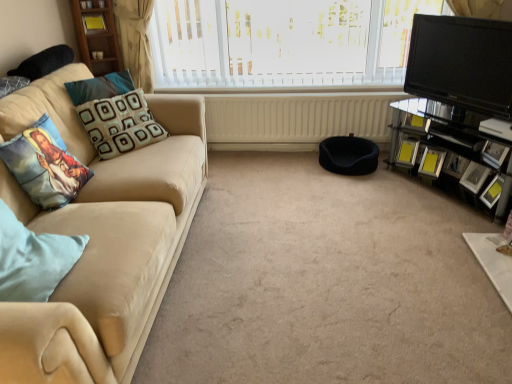
In order to face matte black picture frame at right, which is the 3th picture frame from back to front, should I rotate leftwards or rightwards?

You should rotate right by 27.294 degrees.

In order to face light blue fabric pillow at left, the third pillow from the back, should I rotate leftwards or rightwards?

You should look left and rotate roughly 29.952 degrees.

Measure the distance between yellow paper at right, the first picture frame from the back, and camera.

A distance of 3.16 meters exists between yellow paper at right, the first picture frame from the back, and camera.

What do you see at coordinates (407, 152) in the screenshot? Image resolution: width=512 pixels, height=384 pixels. I see `yellow paper at right, the 5th picture frame viewed from the front` at bounding box center [407, 152].

This screenshot has height=384, width=512. Describe the element at coordinates (494, 154) in the screenshot. I see `metallic silver picture frame at right, positioned as the first picture frame in front-to-back order` at that location.

Identify the location of carpet at center. The width and height of the screenshot is (512, 384). (326, 283).

At what (x,y) coordinates should I click in order to perform the action: click on matte black picture frame at right, which is counted as the 3th picture frame, starting from the front. Please return your answer as a coordinate pair (x, y). This screenshot has width=512, height=384. Looking at the image, I should click on (474, 177).

Is point (296, 56) farther from camera compared to point (441, 168)?

Yes, it is.

How different are the orientations of white textured blinds at upper center and metallic silver picture frame at right, which is the fourth picture frame in front-to-back order, in degrees?

The angular difference between white textured blinds at upper center and metallic silver picture frame at right, which is the fourth picture frame in front-to-back order, is 34.3 degrees.

From the image's perspective, which one is positioned lower, white textured blinds at upper center or metallic silver picture frame at right, the 2th picture frame viewed from the back?

metallic silver picture frame at right, the 2th picture frame viewed from the back.

Which of these two, white textured blinds at upper center or metallic silver picture frame at right, the 2th picture frame viewed from the back, is smaller?

Smaller between the two is metallic silver picture frame at right, the 2th picture frame viewed from the back.

In terms of size, does carpet at center appear bigger or smaller than white glossy table at lower right?

Considering their sizes, carpet at center takes up more space than white glossy table at lower right.

Which object is thinner, carpet at center or white glossy table at lower right?

With smaller width is white glossy table at lower right.

Locate an element on the screen. The image size is (512, 384). plain lying above the white glossy table at lower right (from the image's perspective) is located at coordinates (326, 283).

From a real-world perspective, which is physically above, carpet at center or white glossy table at lower right?

white glossy table at lower right.

How many degrees apart are the facing directions of matte black picture frame at right, which is counted as the 3th picture frame, starting from the front, and black glossy entertainment center at right?

They differ by 15.1 degrees in their facing directions.

Is point (477, 171) farther from viewer compared to point (510, 151)?

Yes, it is behind point (510, 151).

Considering the sizes of objects matte black picture frame at right, which is the 3th picture frame from back to front, and black glossy entertainment center at right in the image provided, who is wider, matte black picture frame at right, which is the 3th picture frame from back to front, or black glossy entertainment center at right?

black glossy entertainment center at right is wider.

In the scene shown: Is matte black picture frame at right, which is counted as the 3th picture frame, starting from the front, at the right side of black glossy entertainment center at right?

Correct, you'll find matte black picture frame at right, which is counted as the 3th picture frame, starting from the front, to the right of black glossy entertainment center at right.

Choose the correct answer: Is metallic silver picture frame at right, the 2th picture frame viewed from the back, inside black glossy entertainment center at right or outside it?

metallic silver picture frame at right, the 2th picture frame viewed from the back, fits inside black glossy entertainment center at right.

In the image, is metallic silver picture frame at right, the 2th picture frame viewed from the back, positioned in front of or behind black glossy entertainment center at right?

In the image, metallic silver picture frame at right, the 2th picture frame viewed from the back, appears behind black glossy entertainment center at right.

Looking at this image, is metallic silver picture frame at right, the 2th picture frame viewed from the back, turned away from black glossy entertainment center at right?

Yes, metallic silver picture frame at right, the 2th picture frame viewed from the back,'s orientation is away from black glossy entertainment center at right.

How distant is metallic silver picture frame at right, the 2th picture frame viewed from the back, from black glossy entertainment center at right?

metallic silver picture frame at right, the 2th picture frame viewed from the back, is 10.67 inches from black glossy entertainment center at right.

Which of these two, beige fabric couch at left or yellow glossy picture frame at right, acting as the second picture frame starting from the front, is thinner?

Thinner between the two is yellow glossy picture frame at right, acting as the second picture frame starting from the front.

Is yellow glossy picture frame at right, the fourth picture frame from the back, located within beige fabric couch at left?

Actually, yellow glossy picture frame at right, the fourth picture frame from the back, is outside beige fabric couch at left.

From a real-world perspective, which object stands above the other?

From a 3D spatial view, beige fabric couch at left is above.

Is beige fabric couch at left positioned with its back to yellow glossy picture frame at right, acting as the second picture frame starting from the front?

beige fabric couch at left does not have its back to yellow glossy picture frame at right, acting as the second picture frame starting from the front.

Considering the points (280, 109) and (504, 148), which point is in front, point (280, 109) or point (504, 148)?

Point (504, 148)

Is cream matte radiator at center positioned beyond the bounds of metallic silver picture frame at right, acting as the fifth picture frame starting from the back?

That's correct, cream matte radiator at center is outside of metallic silver picture frame at right, acting as the fifth picture frame starting from the back.

Can you confirm if cream matte radiator at center is wider than metallic silver picture frame at right, positioned as the first picture frame in front-to-back order?

Correct, the width of cream matte radiator at center exceeds that of metallic silver picture frame at right, positioned as the first picture frame in front-to-back order.

Considering the relative positions of cream matte radiator at center and metallic silver picture frame at right, positioned as the first picture frame in front-to-back order, in the image provided, is cream matte radiator at center in front of metallic silver picture frame at right, positioned as the first picture frame in front-to-back order,?

No.

Which of these two, cream matte radiator at center or light blue fabric pillow at left, the third pillow from the back, is smaller?

With smaller size is light blue fabric pillow at left, the third pillow from the back.

Is cream matte radiator at center not close to light blue fabric pillow at left, the third pillow from the back?

cream matte radiator at center is far away from light blue fabric pillow at left, the third pillow from the back.

From the picture: Between cream matte radiator at center and light blue fabric pillow at left, the third pillow from the back, which one is positioned behind?

cream matte radiator at center is further away from the camera.

Identify the location of window behind the metallic silver picture frame at right, the 2th picture frame viewed from the back. (283, 42).

The width and height of the screenshot is (512, 384). I want to click on plain in front of the white glossy table at lower right, so click(x=326, y=283).

Looking at this image, which object lies nearer to the anchor point metallic silver picture frame at right, positioned as the first picture frame in front-to-back order, cream matte radiator at center or black fabric footrest at center?

The object closer to metallic silver picture frame at right, positioned as the first picture frame in front-to-back order, is black fabric footrest at center.

Looking at the image, which one is located closer to cream matte radiator at center, carpet at center or white textured blinds at upper center?

Among the two, white textured blinds at upper center is located nearer to cream matte radiator at center.

In the scene shown: Based on their spatial positions, is metallic silver picture frame at right, the 2th picture frame viewed from the back, or beige fabric couch at left further from cream matte radiator at center?

beige fabric couch at left.

Estimate the real-world distances between objects in this image. Which object is further from white glossy table at lower right, yellow paper at right, the 5th picture frame viewed from the front, or metallic silver picture frame at right, which is the fourth picture frame in front-to-back order?

Based on the image, yellow paper at right, the 5th picture frame viewed from the front, appears to be further to white glossy table at lower right.

Which object lies nearer to the anchor point black fabric footrest at center, light blue fabric pillow at left, which is the 1th pillow in front-to-back order, or patterned fabric pillow at left, the third pillow in the front-to-back sequence?

Among the two, patterned fabric pillow at left, the third pillow in the front-to-back sequence, is located nearer to black fabric footrest at center.

Estimate the real-world distances between objects in this image. Which object is closer to white textured blinds at upper center, black glossy entertainment center at right or patterned fabric pillow at left, the third pillow in the front-to-back sequence?

black glossy entertainment center at right lies closer to white textured blinds at upper center than the other object.

Based on their spatial positions, is black glossy entertainment center at right or printed fabric pillow at left, acting as the second pillow starting from the back, closer to metallic silver picture frame at right, which is the fourth picture frame in front-to-back order?

black glossy entertainment center at right lies closer to metallic silver picture frame at right, which is the fourth picture frame in front-to-back order, than the other object.

Estimate the real-world distances between objects in this image. Which object is further from patterned fabric pillow at left, acting as the first pillow starting from the back, light blue fabric pillow at left, the third pillow from the back, or black glossy entertainment center at right?

Based on the image, black glossy entertainment center at right appears to be further to patterned fabric pillow at left, acting as the first pillow starting from the back.

Locate an element on the screen. This screenshot has width=512, height=384. plain positioned between beige fabric couch at left and yellow paper at right, the 5th picture frame viewed from the front, from near to far is located at coordinates (326, 283).

This screenshot has width=512, height=384. What are the coordinates of `radiator between printed fabric pillow at left, acting as the second pillow starting from the back, and yellow paper at right, the first picture frame from the back` in the screenshot? It's located at (296, 119).

Where is `entertainment center between black glossy tv at upper right and yellow glossy picture frame at right, the fourth picture frame from the back, from top to bottom`? The width and height of the screenshot is (512, 384). entertainment center between black glossy tv at upper right and yellow glossy picture frame at right, the fourth picture frame from the back, from top to bottom is located at coordinates (451, 139).

This screenshot has height=384, width=512. What are the coordinates of `window between cream matte radiator at center and metallic silver picture frame at right, acting as the fifth picture frame starting from the back` in the screenshot? It's located at (283, 42).